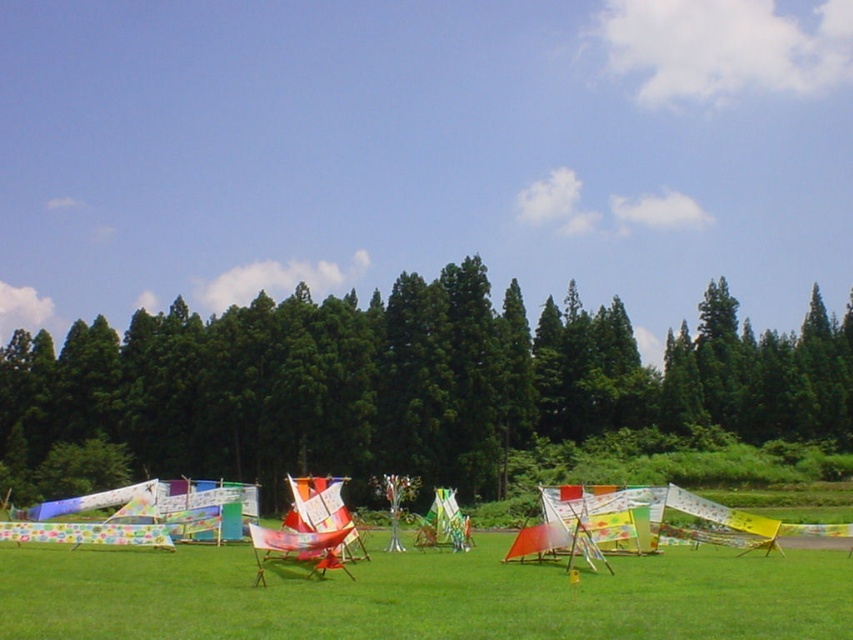
You are planning to set up a picnic blanket in the grassy area. Considering the space occupied by the green leafy tree at center and the green grassy at center, will the tree block sunlight from reaching the blanket if placed directly under it?

The green leafy tree at center might be wider than green grassy at center, so placing the picnic blanket directly under it could block sunlight due to the tree potentially casting a larger shadow over the area.

You are standing in the grassy field and see two points marked on the ground. The first is at point (x=416, y=451) and the second at point (x=766, y=637). Which point is closer to you?

Point (x=416, y=451) is further to the camera than point (x=766, y=637), so the point closer to you is point (x=766, y=637).

Consider the image. You are a park ranger who needs to place a new bench between the green leafy tree at center and the dense line of tall evergreen trees in the background. The bench requires 10 feet of space to be placed safely. Is there enough space between them?

The distance between the green leafy tree at center and the dense line of tall evergreen trees in the background is 213.05 feet. Since the bench only needs 10 feet of space, there is more than enough room to place it safely between them.